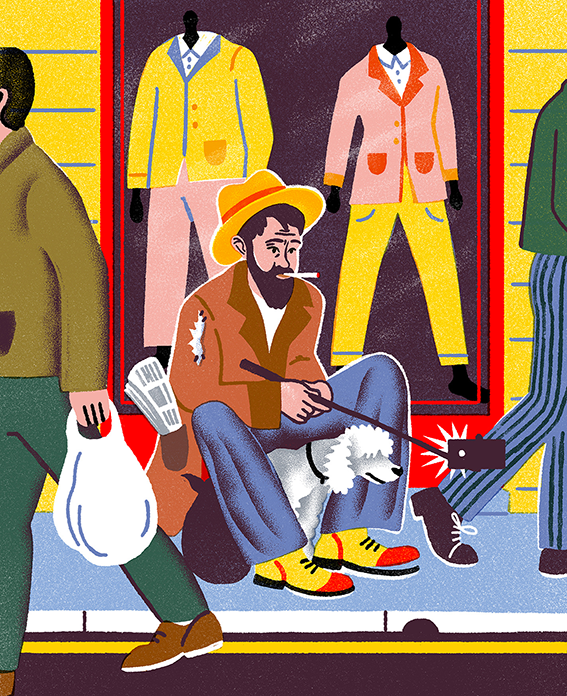
Where is `newspaper`? This screenshot has height=696, width=567. newspaper is located at coordinates (160, 395).